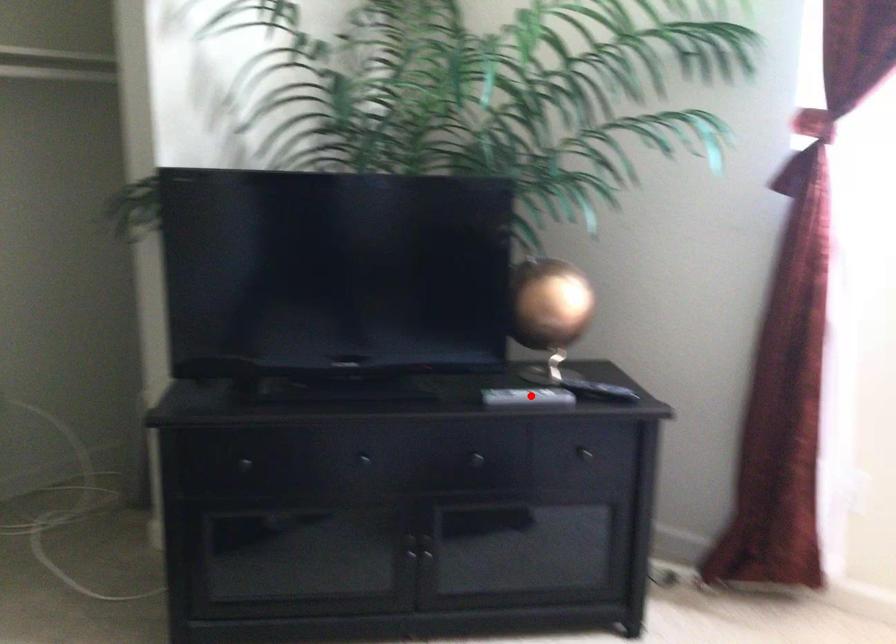
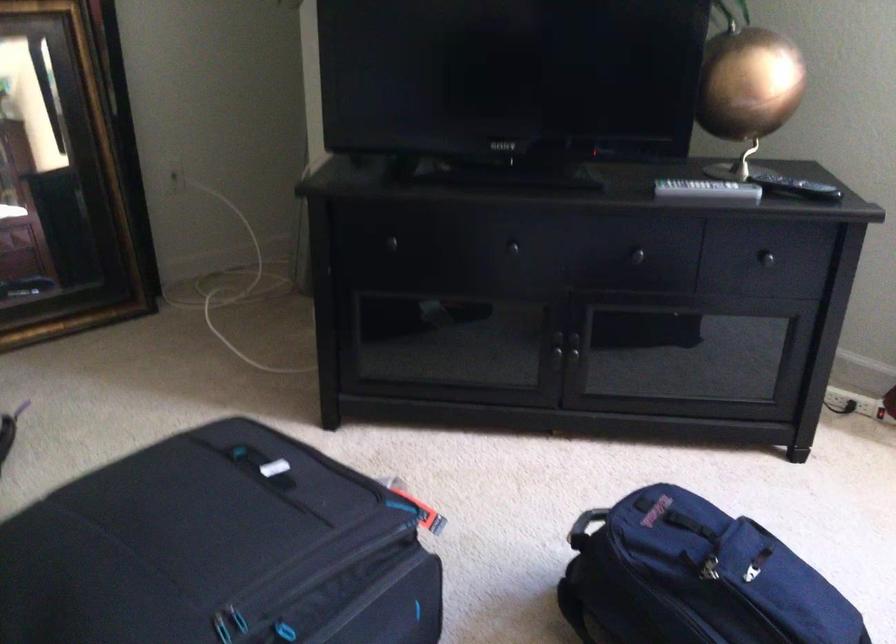
Question: I am providing you with two images of the same scene from different viewpoints. In image1, a red point is highlighted. Considering the same 3D point in image2, which of the following is correct?

Choices:
 (A) It is closer
 (B) It is farther

Answer: (A)